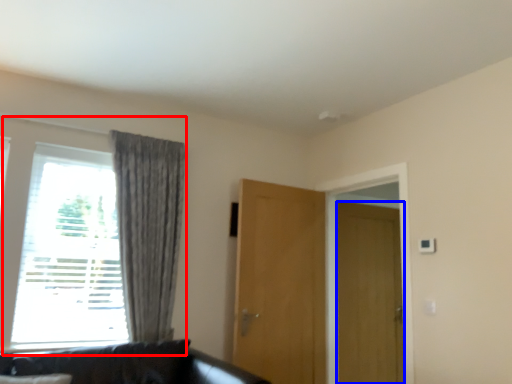
Question: Which object is further to the camera taking this photo, window (highlighted by a red box) or door (highlighted by a blue box)?

Choices:
 (A) window
 (B) door

Answer: (B)